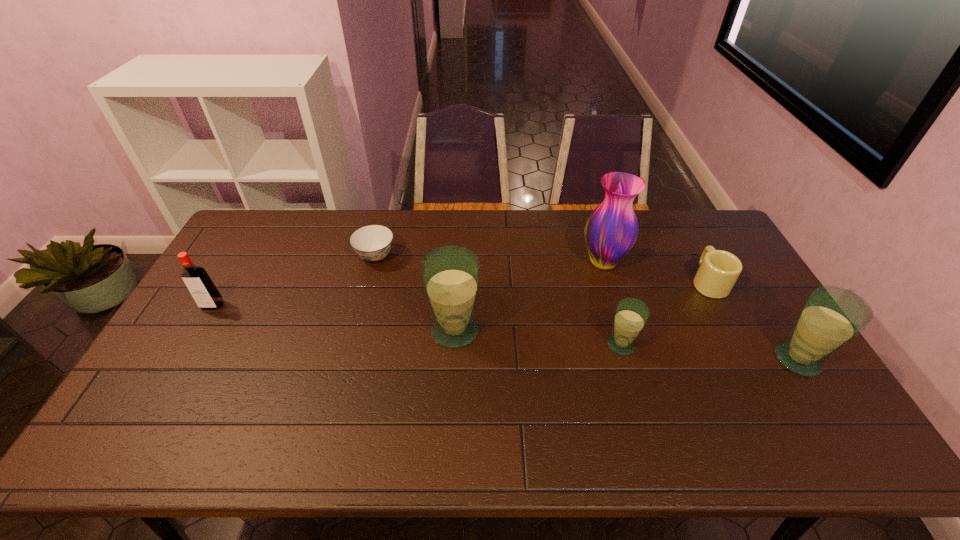
The image size is (960, 540). Find the location of `free space between the rightmost glass and the tallest object`. free space between the rightmost glass and the tallest object is located at coordinates (700, 311).

This screenshot has width=960, height=540. Find the location of `vacant space that is in between the soup bowl and the second shortest glass`. vacant space that is in between the soup bowl and the second shortest glass is located at coordinates (587, 308).

I want to click on object identified as the closest to the leftmost glass, so click(372, 243).

The width and height of the screenshot is (960, 540). Identify the location of object that is the sixth nearest to the second glass from right to left. (204, 292).

This screenshot has height=540, width=960. In order to click on glass that stands as the closest to the soup bowl in this screenshot , I will do `click(451, 275)`.

Find the location of `the second closest glass to the rightmost object`. the second closest glass to the rightmost object is located at coordinates (451, 275).

I want to click on free location that satisfies the following two spatial constraints: 1. on the front and back of the vodka; 2. on the left side of the second shortest glass, so click(180, 360).

I want to click on free space in the image that satisfies the following two spatial constraints: 1. on the front and back of the fourth nearest object; 2. on the right side of the rightmost object, so click(x=180, y=360).

The width and height of the screenshot is (960, 540). In order to click on vacant space that satisfies the following two spatial constraints: 1. on the front and back of the second shortest glass; 2. on the right side of the fourth nearest object in this screenshot , I will do coord(180,360).